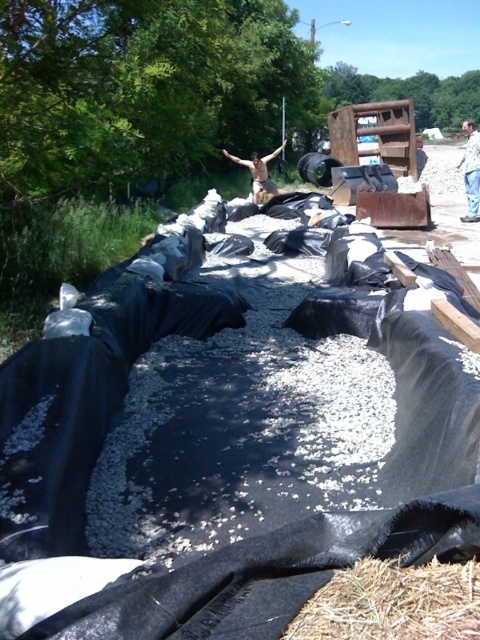
Question: Estimate the real-world distances between objects in this image. Which object is closer to the skinny man at center?

Choices:
 (A) tan fabric shirt at center
 (B) brown dry hay at lower right

Answer: (A)

Question: Is tan fabric shirt at center further to camera compared to skinny man at center?

Choices:
 (A) yes
 (B) no

Answer: (B)

Question: Observing the image, what is the correct spatial positioning of tan fabric shirt at center in reference to skinny man at center?

Choices:
 (A) right
 (B) left

Answer: (A)

Question: Where is tan fabric shirt at center located in relation to skinny man at center in the image?

Choices:
 (A) left
 (B) right

Answer: (B)

Question: Which point appears closest to the camera in this image?

Choices:
 (A) (472, 202)
 (B) (273, 192)

Answer: (A)

Question: Estimate the real-world distances between objects in this image. Which object is closer to the skinny man at center?

Choices:
 (A) brown dry hay at lower right
 (B) tan fabric shirt at center

Answer: (B)